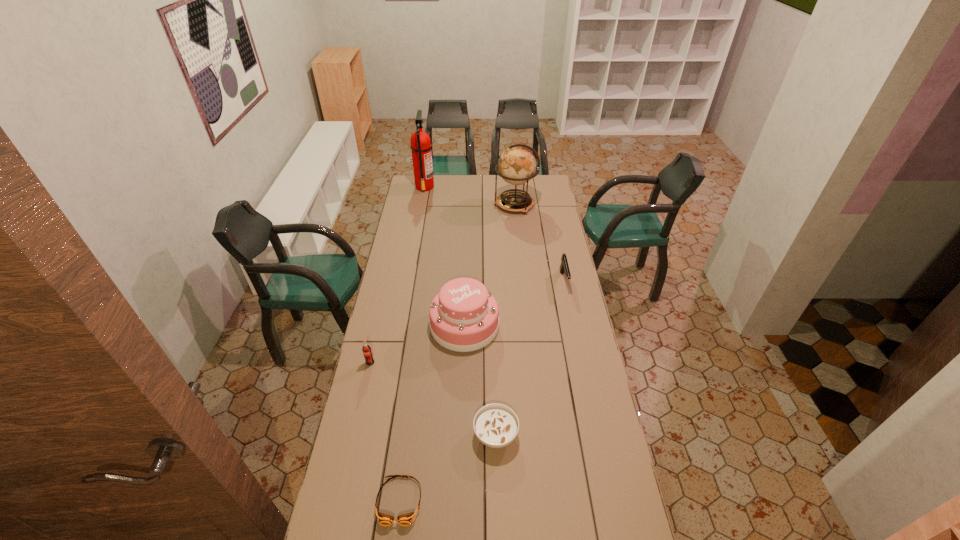
Where is `free spot at the left edge of the desktop`? free spot at the left edge of the desktop is located at coordinates (393, 261).

This screenshot has width=960, height=540. What are the coordinates of `free region at the right edge of the desktop` in the screenshot? It's located at point(555,276).

Find the location of a particular element. This screenshot has width=960, height=540. vacant area that lies between the soda bottle and the sixth farthest object is located at coordinates (433, 399).

Locate an element on the screen. Image resolution: width=960 pixels, height=540 pixels. unoccupied position between the fifth farthest object and the sixth farthest object is located at coordinates (433, 399).

Find the location of `vacant area between the fire extinguisher and the third farthest object`. vacant area between the fire extinguisher and the third farthest object is located at coordinates (494, 234).

Locate an element on the screen. unoccupied area between the third tallest object and the sixth tallest object is located at coordinates (480, 380).

At what (x,y) coordinates should I click in order to perform the action: click on vacant area that lies between the rightmost object and the fifth shortest object. Please return your answer as a coordinate pair (x, y). The height and width of the screenshot is (540, 960). Looking at the image, I should click on (515, 303).

This screenshot has width=960, height=540. Find the location of `free area in between the globe and the soup bowl`. free area in between the globe and the soup bowl is located at coordinates (505, 320).

Where is `empty space that is in between the fourth shortest object and the soup bowl`? empty space that is in between the fourth shortest object and the soup bowl is located at coordinates (433, 399).

This screenshot has width=960, height=540. In order to click on vacant area that lies between the fire extinguisher and the fourth shortest object in this screenshot , I will do `click(397, 275)`.